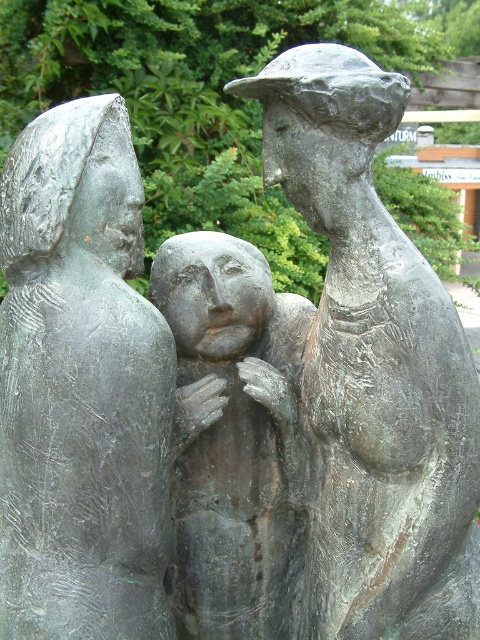
You are a photographer standing 1.17 meters away from the bronze textured figure at left. You want to capture a closeup shot of the sculpture without getting too close. Can you do that?

Yes, since you are already 1.17 meters away from the bronze textured figure at left, which is the closest part of the sculpture, you can take a closeup shot from that distance without needing to get closer.

You are a tour guide explaining the bronze sculpture. You want to point out the spatial relationship between the bronze textured figure at left and bronze sculpture at center. Which direction should you indicate when describing their positions?

The bronze textured figure at left is positioned to the left of the bronze sculpture at center, so you should indicate the left direction when describing their positions.

You are an art curator planning to display the bronze statue at upper right and the bronze sculpture at center in a gallery. Given their sizes, which one would require a larger base to support it?

The bronze statue at upper right requires a larger base because it is larger in size than the bronze sculpture at center.